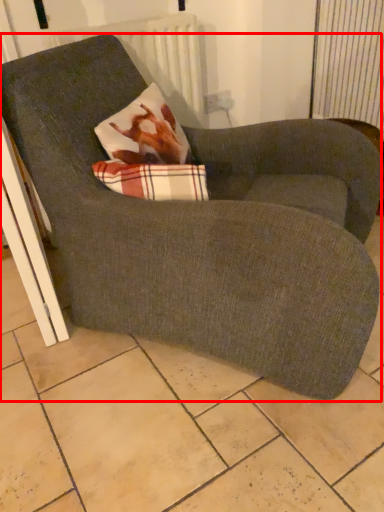
Question: In this image, where is chair (annotated by the red box) located relative to radiator?

Choices:
 (A) left
 (B) right

Answer: (B)